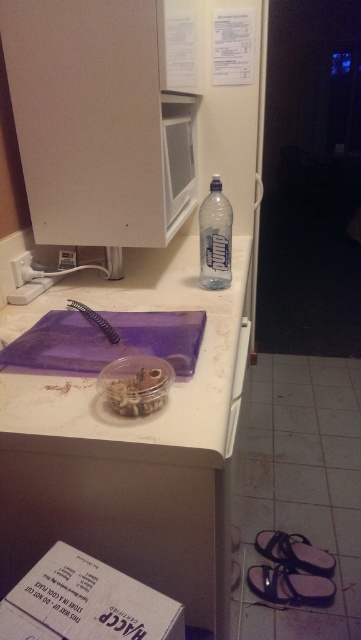
You are organizing the kitchen and need to place a new spice jar. The spice jar is 15 cm tall. You see the transparent plastic bottle at center and the white plastic drawer at lower center. Which object can the spice jar fit into based on their vertical space?

The transparent plastic bottle at center is located above the white plastic drawer at lower center. Since the spice jar is 15 cm tall, it can fit into the transparent plastic bottle at center if there is enough vertical space. However, without specific height measurements, it is safer to assume the white plastic drawer at lower center might have more vertical space for the spice jar.

You are preparing a meal and need to place both the white matte cutting board at center and the translucent plastic jar at center on the counter. Which object should you place first to ensure there is enough space for both?

The white matte cutting board at center is taller than the translucent plastic jar at center, so you should place the taller cutting board first to ensure stability and space for the shorter jar.